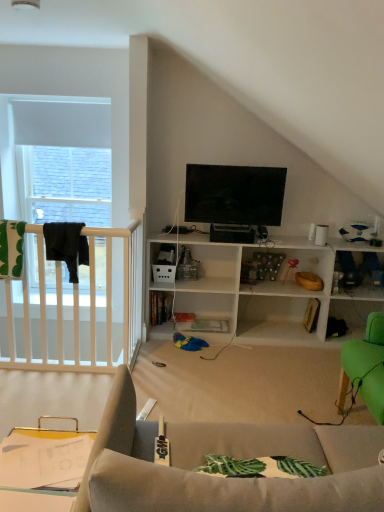
Question: Is clear plastic tray at lower left outside black fabric at left?

Choices:
 (A) no
 (B) yes

Answer: (B)

Question: From the image's perspective, would you say clear plastic tray at lower left is shown under black fabric at left?

Choices:
 (A) no
 (B) yes

Answer: (B)

Question: Is clear plastic tray at lower left closer to the viewer compared to black fabric at left?

Choices:
 (A) yes
 (B) no

Answer: (A)

Question: From a real-world perspective, is clear plastic tray at lower left over black fabric at left?

Choices:
 (A) no
 (B) yes

Answer: (A)

Question: Considering the relative sizes of clear plastic tray at lower left and black fabric at left in the image provided, is clear plastic tray at lower left thinner than black fabric at left?

Choices:
 (A) no
 (B) yes

Answer: (A)

Question: Considering the positions of clear plastic tray at lower left and black fabric at left in the image, is clear plastic tray at lower left bigger or smaller than black fabric at left?

Choices:
 (A) big
 (B) small

Answer: (A)

Question: From a real-world perspective, relative to black fabric at left, is clear plastic tray at lower left vertically above or below?

Choices:
 (A) below
 (B) above

Answer: (A)

Question: From their relative heights in the image, would you say clear plastic tray at lower left is taller or shorter than black fabric at left?

Choices:
 (A) tall
 (B) short

Answer: (B)

Question: In terms of width, does clear plastic tray at lower left look wider or thinner when compared to black fabric at left?

Choices:
 (A) wide
 (B) thin

Answer: (A)

Question: Is clear plastic tray at lower left in front of or behind flat screen tv at upper center in the image?

Choices:
 (A) behind
 (B) front

Answer: (B)

Question: Choose the correct answer: Is clear plastic tray at lower left inside flat screen tv at upper center or outside it?

Choices:
 (A) inside
 (B) outside

Answer: (B)

Question: From the image's perspective, is clear plastic tray at lower left above or below flat screen tv at upper center?

Choices:
 (A) above
 (B) below

Answer: (B)

Question: In the image, is clear plastic tray at lower left on the left side or the right side of flat screen tv at upper center?

Choices:
 (A) right
 (B) left

Answer: (B)

Question: Would you say black fabric at left is to the left or to the right of clear plastic tray at lower left in the picture?

Choices:
 (A) left
 (B) right

Answer: (A)

Question: From a real-world perspective, is black fabric at left physically located above or below clear plastic tray at lower left?

Choices:
 (A) above
 (B) below

Answer: (A)